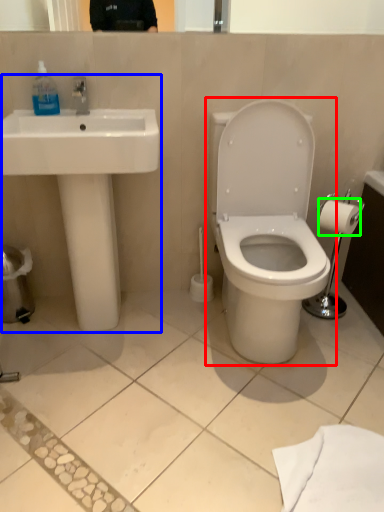
Question: Considering the real-world distances, which object is farthest from toilet (highlighted by a red box)? sink (highlighted by a blue box) or toilet paper (highlighted by a green box)?

Choices:
 (A) sink
 (B) toilet paper

Answer: (A)